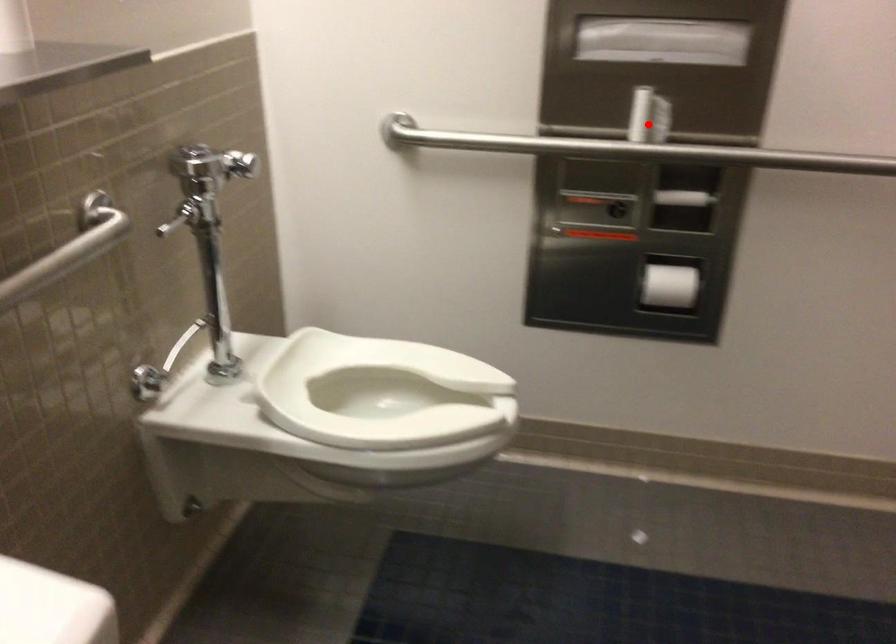
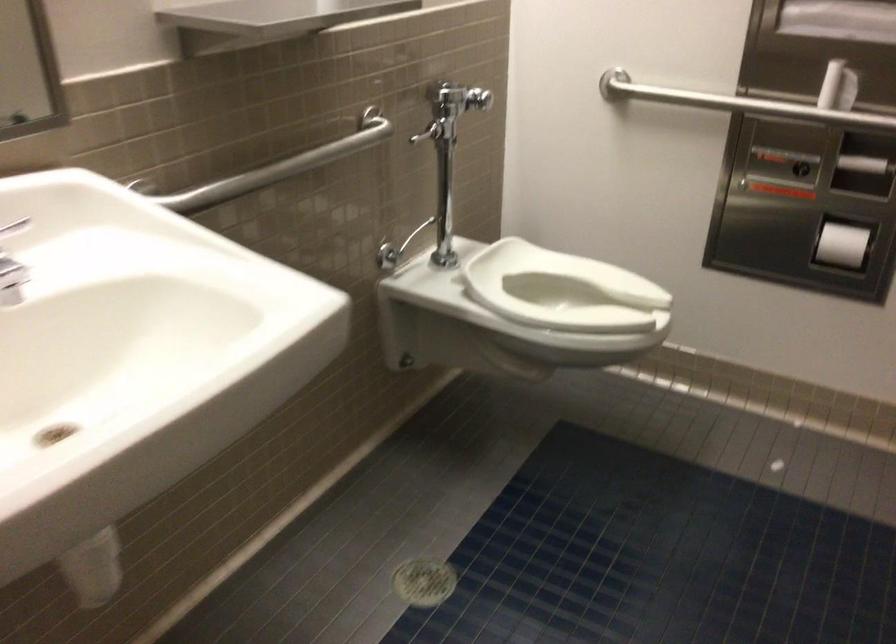
The point at the highlighted location is marked in the first image. Where is the corresponding point in the second image?

(838, 87)